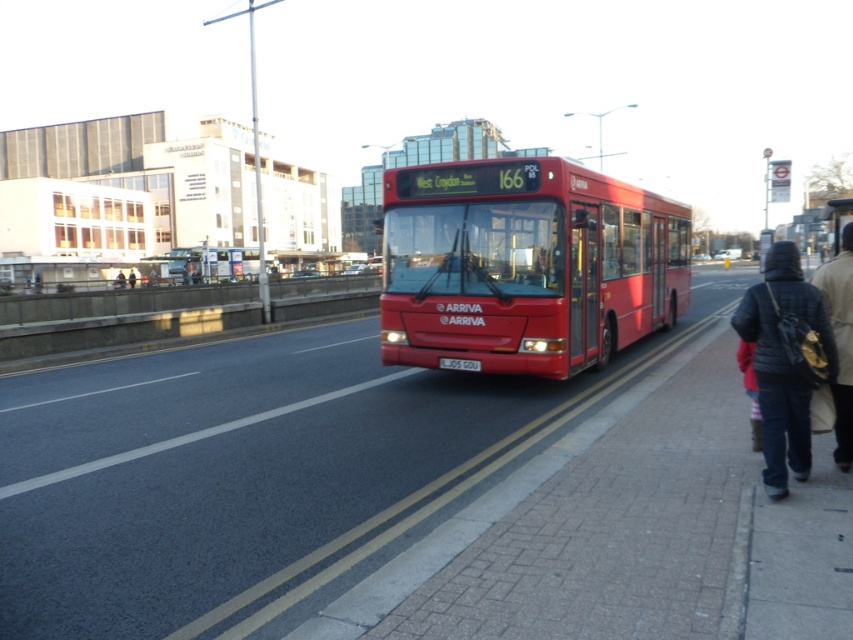
Question: Does brick pavement at center come behind denim jacket at lower right?

Choices:
 (A) no
 (B) yes

Answer: (A)

Question: Which of the following is the closest to the observer?

Choices:
 (A) (639, 268)
 (B) (746, 317)
 (C) (129, 288)
 (D) (844, 401)

Answer: (B)

Question: Does dark blue denim jacket at lower right have a larger size compared to denim jacket at lower right?

Choices:
 (A) yes
 (B) no

Answer: (A)

Question: Which point is closer to the camera?

Choices:
 (A) (206, 461)
 (B) (401, 260)

Answer: (A)

Question: Estimate the real-world distances between objects in this image. Which object is farther from the brick pavement at center?

Choices:
 (A) denim jacket at lower right
 (B) dark blue jacket at center
 (C) matte red bus at center

Answer: (B)

Question: Does brick pavement at center appear on the right side of matte red bus at center?

Choices:
 (A) yes
 (B) no

Answer: (A)